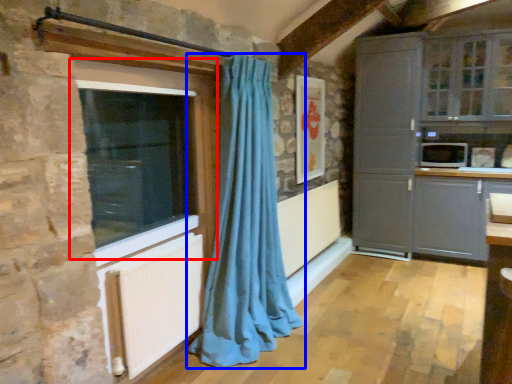
Question: Among these objects, which one is farthest to the camera, window (highlighted by a red box) or curtain (highlighted by a blue box)?

Choices:
 (A) window
 (B) curtain

Answer: (B)